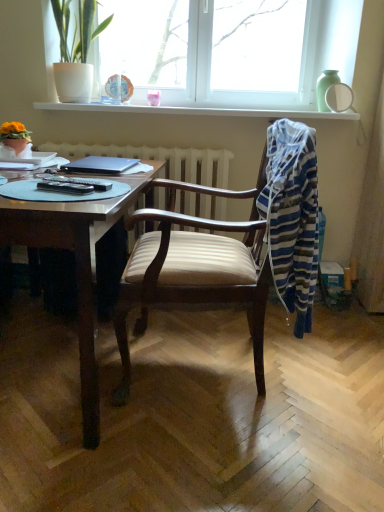
Locate an element on the screen. Image resolution: width=384 pixels, height=512 pixels. vacant space in front of wooden chair at center is located at coordinates (206, 461).